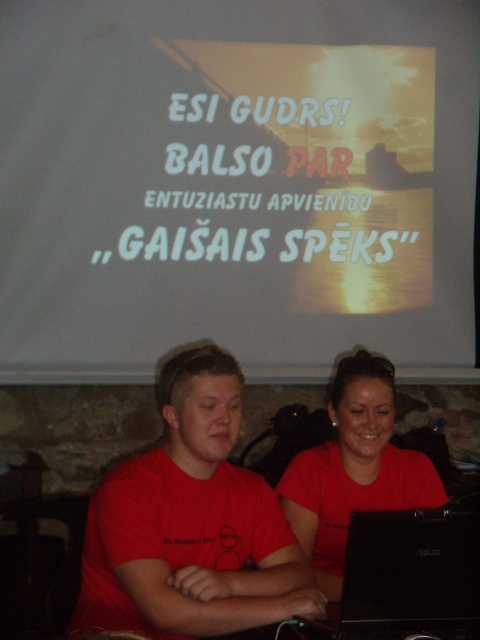
Is white paper at upper center to the right of matte red t-shirt at center from the viewer's perspective?

Indeed, white paper at upper center is positioned on the right side of matte red t-shirt at center.

Does point (107, 182) lie in front of point (236, 420)?

No, (107, 182) is further to viewer.

Find the location of a particular element. white paper at upper center is located at coordinates (237, 186).

Can you confirm if white paper at upper center is smaller than matte red shirt at center?

No, white paper at upper center is not smaller than matte red shirt at center.

Measure the distance between white paper at upper center and camera.

white paper at upper center is 9.79 feet away from camera.

Is point (396, 58) positioned before point (326, 467)?

No, it is behind (326, 467).

The height and width of the screenshot is (640, 480). Find the location of `white paper at upper center`. white paper at upper center is located at coordinates click(x=237, y=186).

Is matte red t-shirt at center shorter than black matte laptop at center?

Incorrect, matte red t-shirt at center's height does not fall short of black matte laptop at center's.

This screenshot has height=640, width=480. In order to click on matte red t-shirt at center in this screenshot , I will do coord(191,524).

This screenshot has width=480, height=640. Find the location of `matte red t-shirt at center`. matte red t-shirt at center is located at coordinates (191, 524).